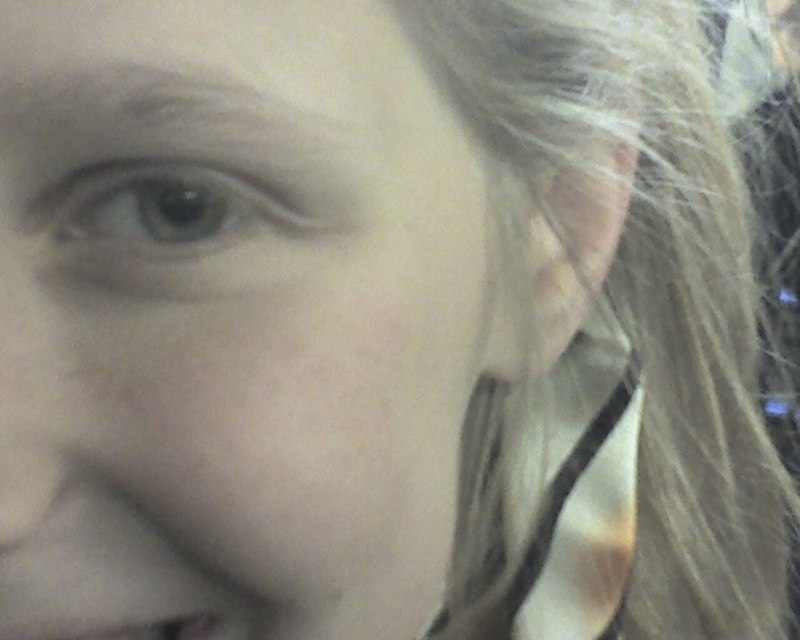
Does blonde hair at right have a larger size compared to gray matte eyebrow at upper left?

Yes, blonde hair at right is bigger than gray matte eyebrow at upper left.

Does point (526, 163) come behind point (148, 140)?

Yes, point (526, 163) is behind point (148, 140).

Is point (720, 476) positioned in front of point (338, 129)?

No, it is behind (338, 129).

Locate an element on the screen. The image size is (800, 640). blonde hair at right is located at coordinates (648, 280).

Between point (202, 241) and point (637, 515), which one is positioned behind?

The point (637, 515) is more distant.

Is point (258, 260) positioned after point (704, 528)?

No.

I want to click on smooth skin at center, so click(241, 298).

Which is above, blonde hair at right or green matte eye at upper left?

green matte eye at upper left is higher up.

Which is in front, point (644, 180) or point (134, 156)?

Point (134, 156) is more forward.

Where is `blonde hair at right`? blonde hair at right is located at coordinates (648, 280).